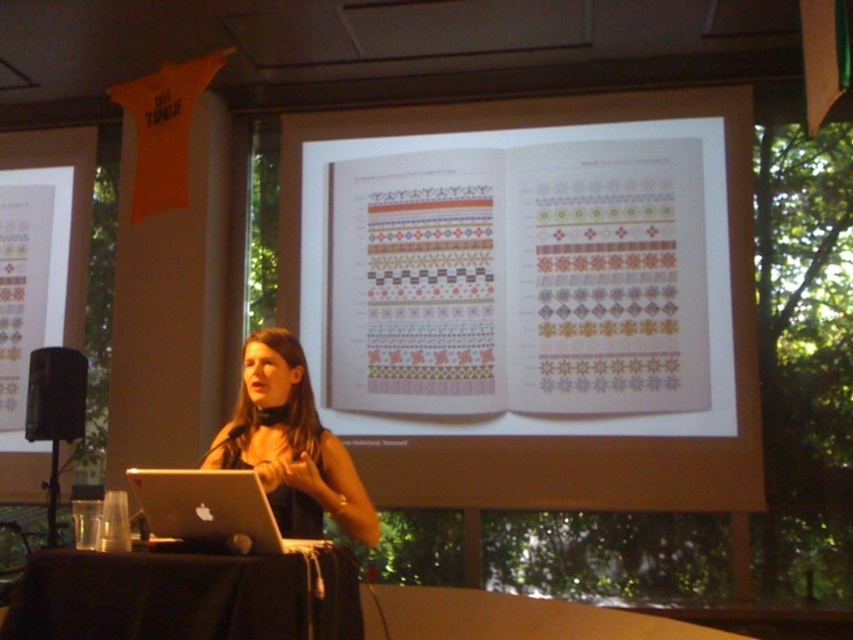
Question: Estimate the real-world distances between objects in this image. Which object is closer to the black matte speaker at left?

Choices:
 (A) black fabric table at lower center
 (B) white paper at center

Answer: (B)

Question: Is white paper at center further to the viewer compared to black fabric table at lower center?

Choices:
 (A) yes
 (B) no

Answer: (A)

Question: Which is farther from the black matte speaker at left?

Choices:
 (A) black matte laptop at center
 (B) black fabric table at lower center

Answer: (B)

Question: Is white paper at center to the left of silver metallic laptop at lower left from the viewer's perspective?

Choices:
 (A) no
 (B) yes

Answer: (A)

Question: Among these points, which one is nearest to the camera?

Choices:
 (A) (676, 488)
 (B) (223, 541)
 (C) (268, 634)

Answer: (C)

Question: Is white paper at center positioned at the back of black matte laptop at center?

Choices:
 (A) no
 (B) yes

Answer: (B)